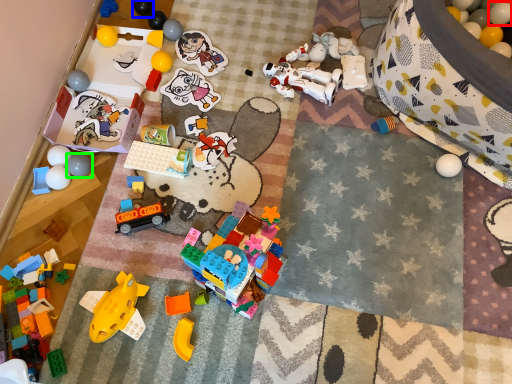
Question: Which object is the farthest from balloon (highlighted by a red box)? Choose among these: toy (highlighted by a blue box) or toy (highlighted by a green box).

Choices:
 (A) toy
 (B) toy

Answer: (B)